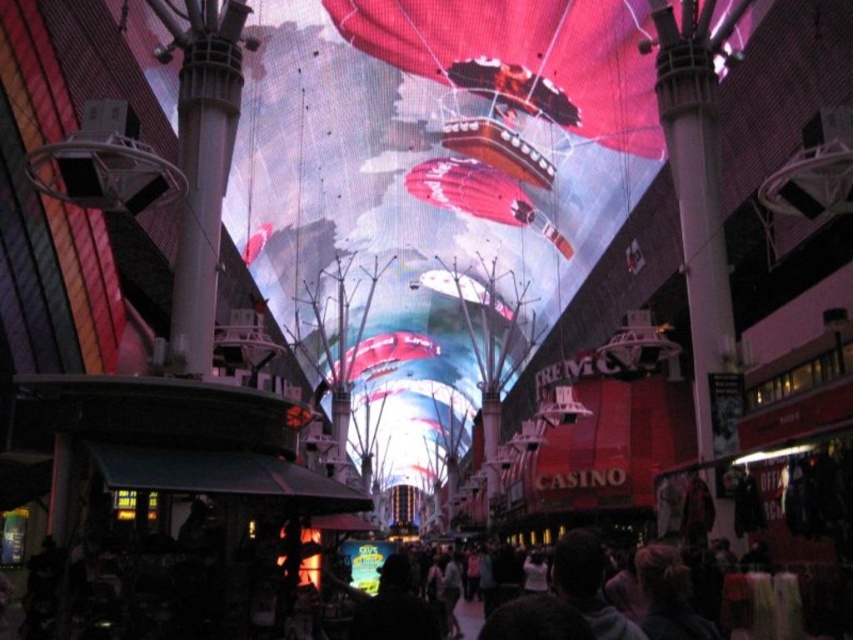
You are standing in the urban area looking up at the large digital display on the ceiling. There is a shiny metallic balloon at upper center. Can you determine if the balloon is closer to the left or right edge of the display?

The shiny metallic balloon at upper center is located at point coordinates that are not provided in the Objects Description. The description only states its position as upper center, so it cannot be determined if it is closer to the left or right edge based on the given information.